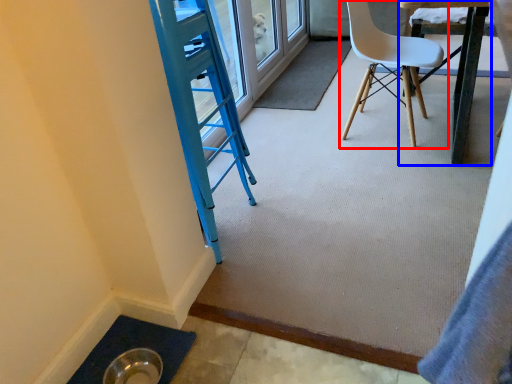
Question: Which of the following is the closest to the observer, chair (highlighted by a red box) or table (highlighted by a blue box)?

Choices:
 (A) chair
 (B) table

Answer: (B)